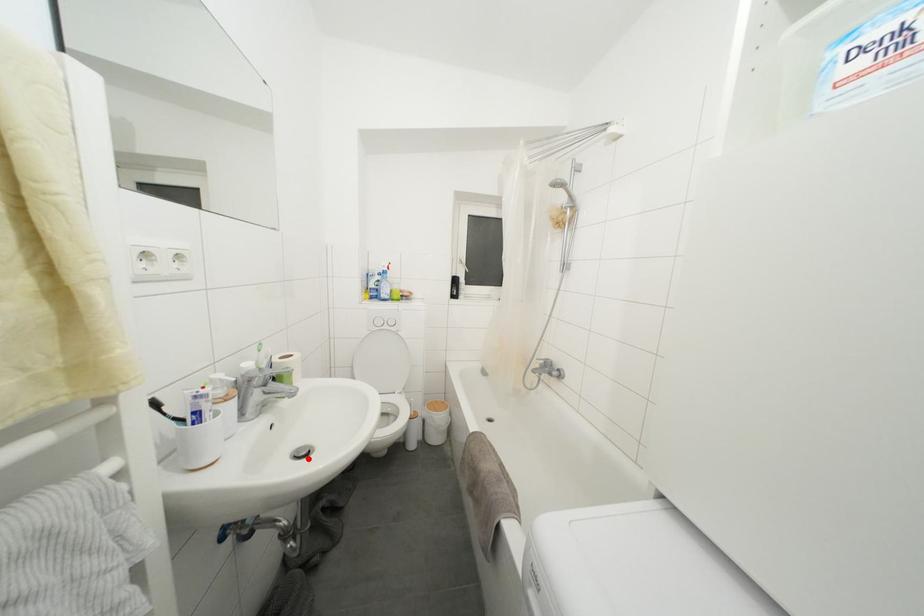
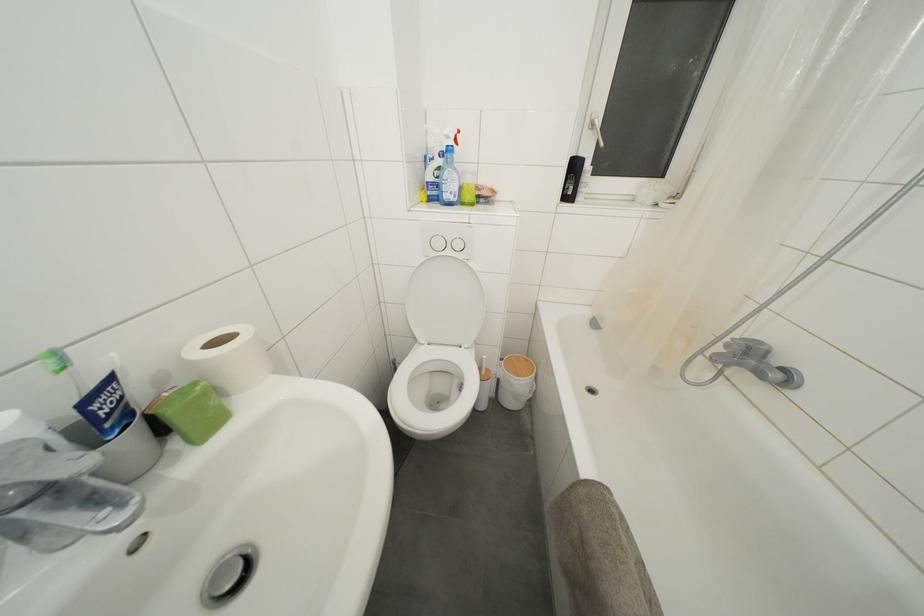
In the second image, find the point that corresponds to the highlighted location in the first image.

(233, 592)